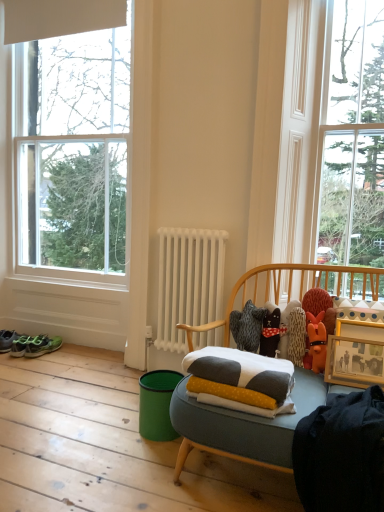
Measure the distance between point (x=170, y=426) and camera.

A distance of 6.29 feet exists between point (x=170, y=426) and camera.

In order to face knitted plush bear at center, should I rotate leftwards or rightwards?

You should rotate right by 10.430 degrees.

Find the location of a particular element. This screenshot has width=384, height=512. knitted plush bear at center is located at coordinates (271, 333).

Where is `soft cotton pillow at center`? soft cotton pillow at center is located at coordinates (242, 371).

You are a GUI agent. You are given a task and a screenshot of the screen. Output one action in this format:
    pyautogui.click(x=<x>, y=<y>)
    Task: Click on the green matte running shoe at lower left
    The width and height of the screenshot is (384, 512).
    Given the screenshot: What is the action you would take?
    pyautogui.click(x=42, y=346)

This screenshot has height=512, width=384. Identify the location of teal fabric at lower center. (157, 404).

Considering the sizes of objects white metal radiator at center and soft cotton pillow at center in the image provided, who is bigger, white metal radiator at center or soft cotton pillow at center?

white metal radiator at center is bigger.

From a real-world perspective, who is located lower, white metal radiator at center or soft cotton pillow at center?

soft cotton pillow at center.

Which object is more forward, white metal radiator at center or soft cotton pillow at center?

Positioned in front is soft cotton pillow at center.

From the image's perspective, does white metal radiator at center appear higher than soft cotton pillow at center?

Yes, from the image's perspective, white metal radiator at center is over soft cotton pillow at center.

Between knitted plush bear at center and green matte running shoe at lower left, which one has smaller width?

Thinner between the two is knitted plush bear at center.

Find the location of a particular element. This screenshot has height=512, width=384. running shoe behind the knitted plush bear at center is located at coordinates (42, 346).

Which is more to the right, knitted plush bear at center or green matte running shoe at lower left?

knitted plush bear at center is more to the right.

Is knitted plush bear at center spatially inside green matte running shoe at lower left, or outside of it?

The correct answer is: outside.

Which is more to the left, white frame window at left, placed as the second window when sorted from right to left, or teal fabric at lower center?

white frame window at left, placed as the second window when sorted from right to left, is more to the left.

Between white frame window at left, placed as the second window when sorted from right to left, and teal fabric at lower center, which one is positioned behind?

white frame window at left, placed as the second window when sorted from right to left, is behind.

Is white frame window at left, the 1th window from the left, with teal fabric at lower center?

No, white frame window at left, the 1th window from the left, is not making contact with teal fabric at lower center.

Which of these two, white frame window at left, placed as the second window when sorted from right to left, or teal fabric at lower center, is bigger?

white frame window at left, placed as the second window when sorted from right to left.

Looking at this image, between clear glass window at upper right, the first window positioned from the right, and white metal radiator at center, which one appears on the left side from the viewer's perspective?

white metal radiator at center.

Which is behind, clear glass window at upper right, the second window in the left-to-right sequence, or white metal radiator at center?

Positioned behind is white metal radiator at center.

Can you tell me how much clear glass window at upper right, the second window in the left-to-right sequence, and white metal radiator at center differ in facing direction?

The angular difference between clear glass window at upper right, the second window in the left-to-right sequence, and white metal radiator at center is 0.484 degrees.

Which is closer, (359,265) or (186,241)?

Clearly, point (359,265) is closer to the camera than point (186,241).

Consider the image. Can you confirm if white metal radiator at center is shorter than knitted plush bear at center?

No.

Is white metal radiator at center touching knitted plush bear at center?

white metal radiator at center and knitted plush bear at center are not in contact.

From a real-world perspective, between white metal radiator at center and knitted plush bear at center, who is vertically higher?

In real-world perspective, white metal radiator at center is above.

Does white metal radiator at center have a smaller size compared to knitted plush bear at center?

No, white metal radiator at center is not smaller than knitted plush bear at center.

Considering the positions of objects green matte running shoe at lower left and green fabric sneakers at lower left in the image provided, who is more to the right, green matte running shoe at lower left or green fabric sneakers at lower left?

From the viewer's perspective, green matte running shoe at lower left appears more on the right side.

From a real-world perspective, relative to green fabric sneakers at lower left, is green matte running shoe at lower left vertically above or below?

green matte running shoe at lower left is above green fabric sneakers at lower left.

Can we say green matte running shoe at lower left lies outside green fabric sneakers at lower left?

That's correct, green matte running shoe at lower left is outside of green fabric sneakers at lower left.

Looking at this image, which of these two, green matte running shoe at lower left or green fabric sneakers at lower left, is smaller?

green matte running shoe at lower left is smaller.

How many degrees apart are the facing directions of green fabric sneakers at lower left and soft cotton pillow at center?

The angular difference between green fabric sneakers at lower left and soft cotton pillow at center is 10 degrees.

From the image's perspective, is green fabric sneakers at lower left located beneath soft cotton pillow at center?

Yes, from the image's perspective, green fabric sneakers at lower left is beneath soft cotton pillow at center.

Considering their positions, is green fabric sneakers at lower left located in front of or behind soft cotton pillow at center?

green fabric sneakers at lower left is behind soft cotton pillow at center.

From the picture: Who is taller, green fabric sneakers at lower left or soft cotton pillow at center?

green fabric sneakers at lower left.

Where is `pillow in front of the white metal radiator at center`? The height and width of the screenshot is (512, 384). pillow in front of the white metal radiator at center is located at coordinates (242, 371).

I want to click on running shoe that is under the knitted plush bear at center (from a real-world perspective), so click(42, 346).

From the image, which object appears to be nearer to green matte running shoe at lower left, white metal radiator at center or knitted plush bear at center?

Among the two, white metal radiator at center is located nearer to green matte running shoe at lower left.

Estimate the real-world distances between objects in this image. Which object is closer to white frame window at left, placed as the second window when sorted from right to left, clear glass window at upper right, the second window in the left-to-right sequence, or green fabric sneakers at lower left?

green fabric sneakers at lower left is closer to white frame window at left, placed as the second window when sorted from right to left.

Estimate the real-world distances between objects in this image. Which object is closer to green fabric sneakers at lower left, knitted plush bear at center or green matte running shoe at lower left?

Based on the image, green matte running shoe at lower left appears to be nearer to green fabric sneakers at lower left.

From the picture: Which object lies further to the anchor point green fabric sneakers at lower left, teal fabric at lower center or green matte running shoe at lower left?

Based on the image, teal fabric at lower center appears to be further to green fabric sneakers at lower left.

Based on their spatial positions, is soft cotton pillow at center or wooden picture frame at right closer to white frame window at left, placed as the second window when sorted from right to left?

soft cotton pillow at center lies closer to white frame window at left, placed as the second window when sorted from right to left, than the other object.

Estimate the real-world distances between objects in this image. Which object is closer to white frame window at left, the 1th window from the left, soft cotton pillow at center or green matte running shoe at lower left?

The object closer to white frame window at left, the 1th window from the left, is green matte running shoe at lower left.

Estimate the real-world distances between objects in this image. Which object is further from wooden picture frame at right, green matte running shoe at lower left or knitted plush bear at center?

green matte running shoe at lower left.

Based on their spatial positions, is soft cotton pillow at center or white metal radiator at center closer to green matte running shoe at lower left?

white metal radiator at center is closer to green matte running shoe at lower left.

You are a GUI agent. You are given a task and a screenshot of the screen. Output one action in this format:
    pyautogui.click(x=<x>, y=<y>)
    Task: Click on the pillow between green matte running shoe at lower left and clear glass window at upper right, the first window positioned from the right
    
    Given the screenshot: What is the action you would take?
    pyautogui.click(x=242, y=371)

Image resolution: width=384 pixels, height=512 pixels. What are the coordinates of `teal between green matte running shoe at lower left and white metal radiator at center from left to right` in the screenshot? It's located at (157, 404).

You are a GUI agent. You are given a task and a screenshot of the screen. Output one action in this format:
    pyautogui.click(x=<x>, y=<y>)
    Task: Click on the picture frame between clear glass window at upper right, the second window in the left-to-right sequence, and teal fabric at lower center, in the vertical direction
    
    Given the screenshot: What is the action you would take?
    pyautogui.click(x=355, y=354)

Image resolution: width=384 pixels, height=512 pixels. Identify the location of pillow between white frame window at left, the 1th window from the left, and knitted plush bear at center, in the horizontal direction. (242, 371).